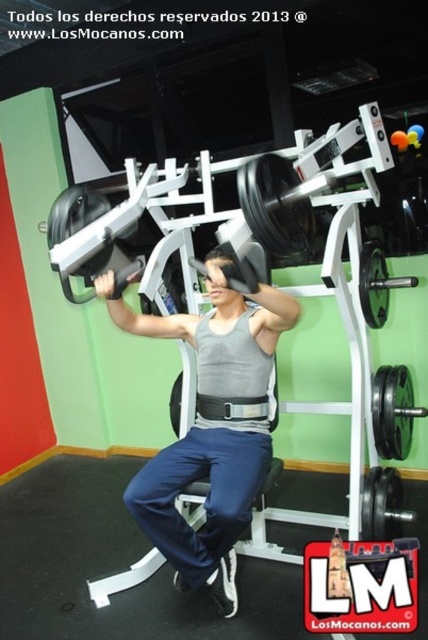
You are a gym trainer observing a client working out. You notice the gray matte tank top at center and the black rubber barbell at center. Which object is positioned to the left of the other?

The gray matte tank top at center is to the left of the black rubber barbell at center.

You are a gym trainer observing a client wearing a gray matte tank top at center. The client wants to adjust the weight stack on the machine but notices their tank top might interfere with the machine handles. The handles are 1.64 meters away from the tank top. Can the client safely adjust the weights without the tank top getting caught?

The gray matte tank top at center is 1.64 meters away from the handles. Since the distance is sufficient, the client can safely adjust the weights without the tank top getting caught.

You are a gym trainer observing a client performing a shoulder press. The client is wearing a gray matte tank top at center and using a black rubber barbell at center. Based on the equipment and clothing, which item is more likely to be in contact with the floor?

The black rubber barbell at center is more likely to be in contact with the floor because it is shorter than the gray matte tank top at center.